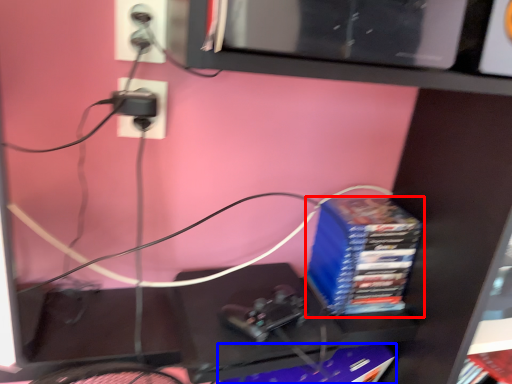
Question: Which object appears farthest to the camera in this image, paperback book (highlighted by a red box) or paperback book (highlighted by a blue box)?

Choices:
 (A) paperback book
 (B) paperback book

Answer: (A)